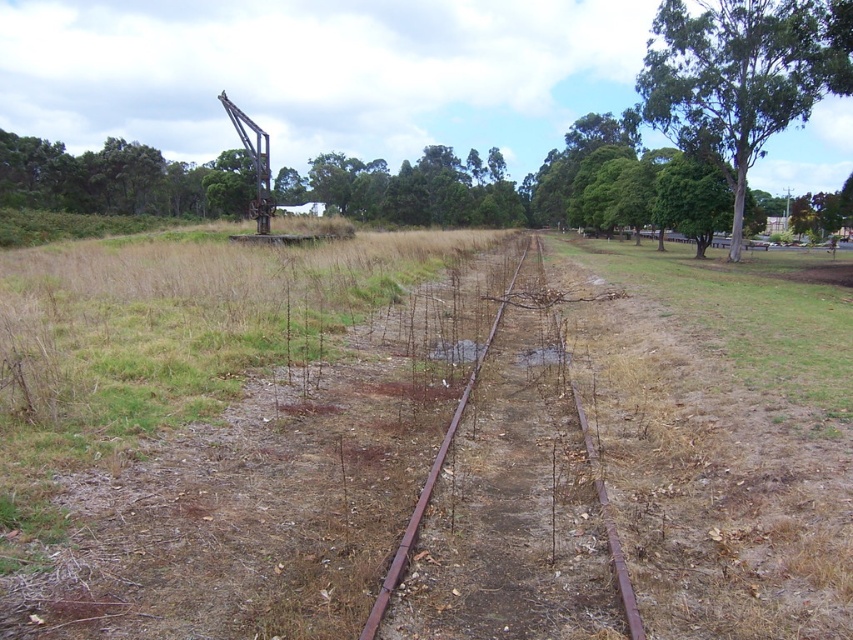
You are standing at the point labeled point (543, 461) and want to walk towards the point labeled point (683, 83). Given that both points are on the abandoned railway tracks, which direction should you face to move towards your destination?

Since point (543, 461) is closer to the camera than point (683, 83), you should face towards the bottom left of the image to walk towards point (683, 83) along the railway tracks.

You are standing at the bottom left of the image and want to walk towards the green leafy tree at upper right. Which direction should you head relative to the rusty metal train track at center?

You should head to the right of the rusty metal train track at center to reach the green leafy tree at upper right, as the tree is located to the right side of the track.

You are standing at the bottom left corner of the image. Which direction should you walk to reach the rusty metal train track at center?

You should walk diagonally towards the center right of the image to reach the rusty metal train track at center, as it is positioned at point (512, 499) which is towards the center right from the bottom left corner.